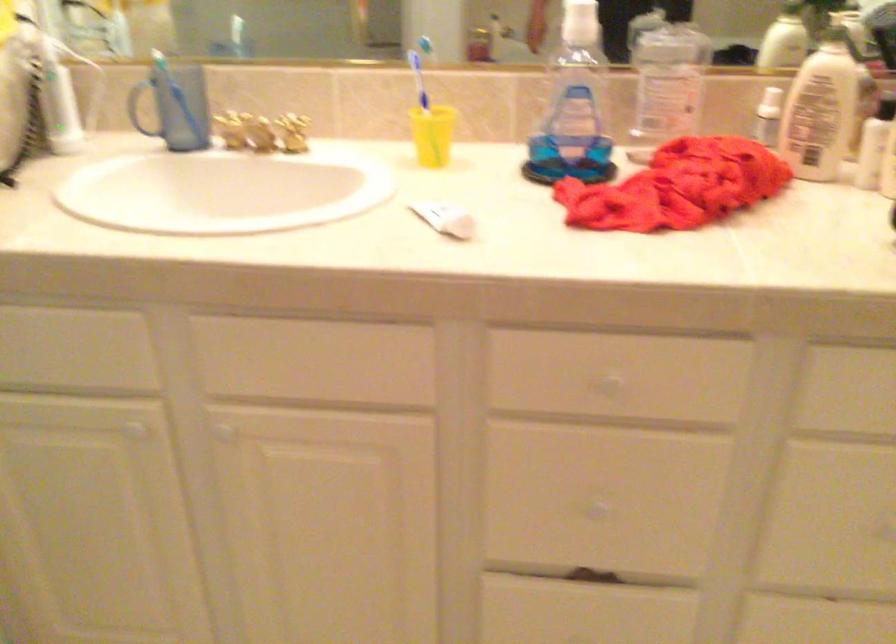
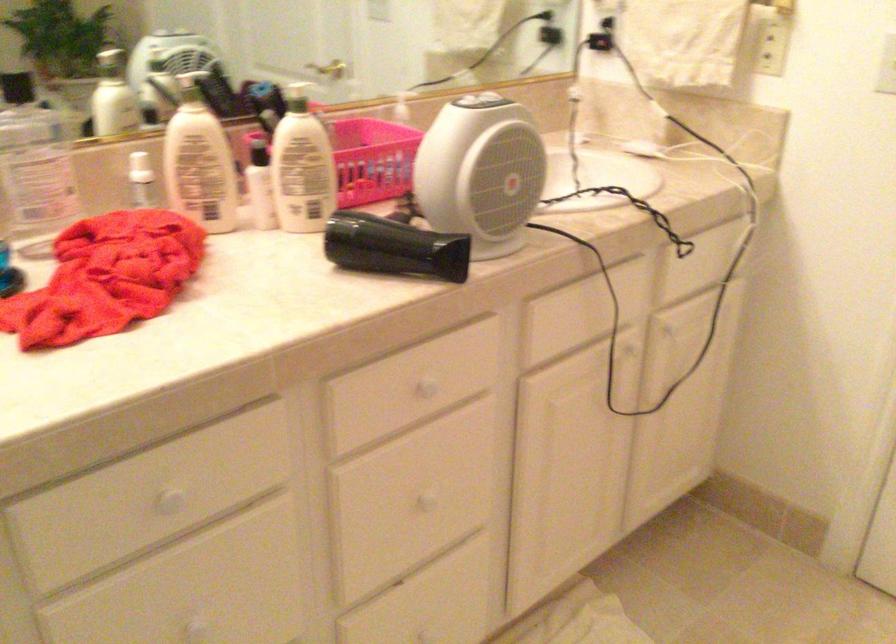
Find the pixel in the second image that matches the point at 760,100 in the first image.

(140, 167)